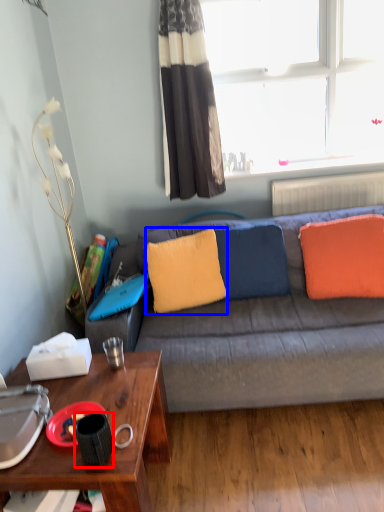
Question: Which of the following is the closest to the observer, coffee cup (highlighted by a red box) or pillow (highlighted by a blue box)?

Choices:
 (A) coffee cup
 (B) pillow

Answer: (A)